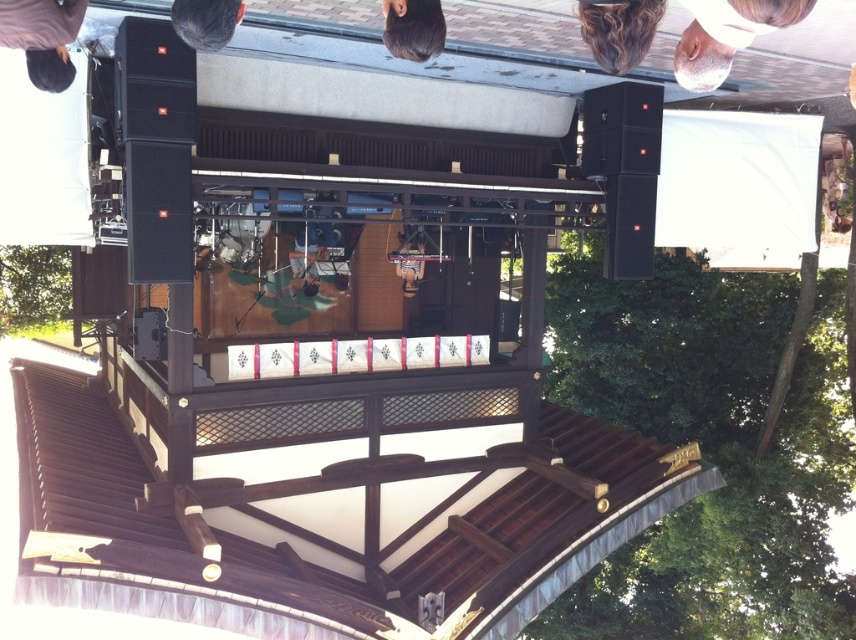
You are a photographer reviewing the rotated image of the outdoor event. You notice two individuals with dark brown hair at upper center and dark brown hair at upper left. Which of these two has a smaller head size in the photo?

The dark brown hair at upper center has a smaller head size compared to the dark brown hair at upper left in the photo.

You are an event planner observing the stage setup for the performance. You notice two attendees with dark brown hair at upper center and dark brown hair at upper left. Which attendee has hair that reaches higher up towards the top of the image?

The dark brown hair at upper center has a greater height compared to the dark brown hair at upper left, so the attendee with dark brown hair at upper center has hair that reaches higher up towards the top of the image.

You are an event organizer checking the stage setup for the performance. You notice a dark brown sweater at upper left. Based on its position, is it likely placed on the stage or among the audience?

The dark brown sweater at upper left is located at point (42,36), which places it on the stage area since the stage occupies the lower part of the image. Therefore, it is likely placed on the stage.